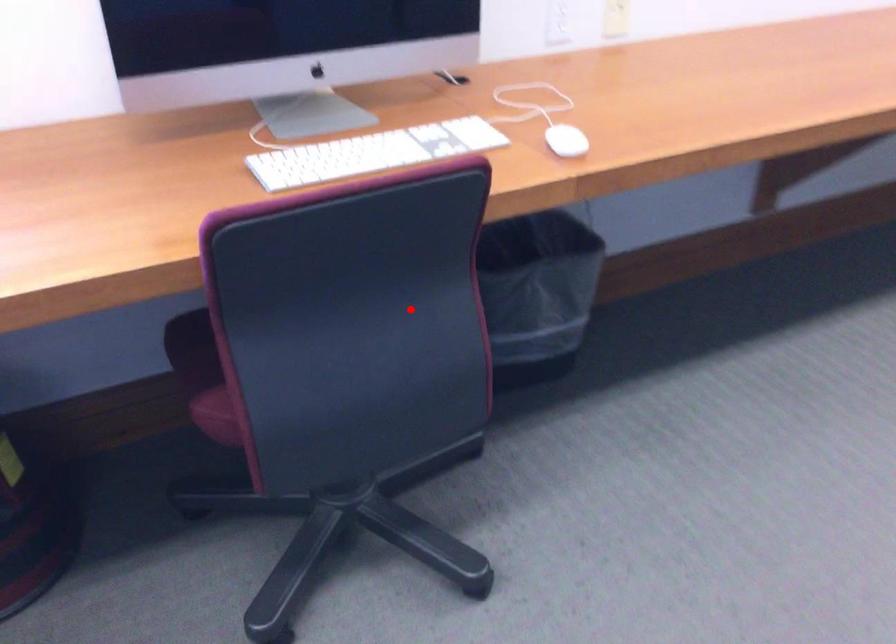
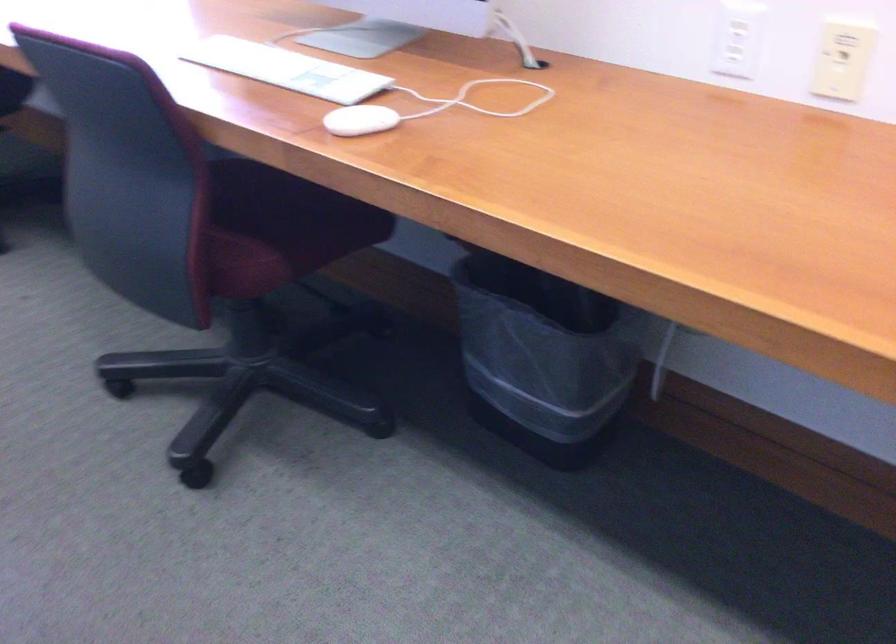
Question: A red point is marked in image1. In image2, is the corresponding 3D point closer to the camera or farther? Reply with the corresponding letter.

Choices:
 (A) The corresponding 3D point is closer.
 (B) The corresponding 3D point is farther.

Answer: (B)